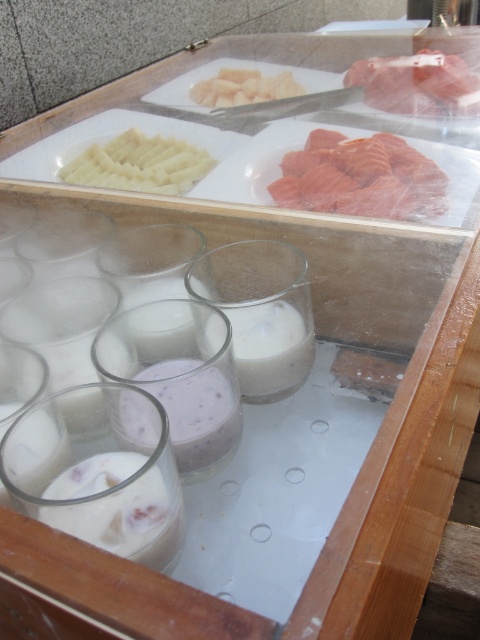
Question: Which object appears farthest from the camera in this image?

Choices:
 (A) pinkish-orange flesh at upper right
 (B) white creamy sliced potatoes at upper left
 (C) purple creamy smoothie at center

Answer: (B)

Question: Considering the relative positions of purple creamy smoothie at center and pinkish raw meat at upper right in the image provided, where is purple creamy smoothie at center located with respect to pinkish raw meat at upper right?

Choices:
 (A) left
 (B) right

Answer: (A)

Question: Which point is farther to the camera?

Choices:
 (A) (179, 156)
 (B) (298, 321)
 (C) (251, 70)
 (D) (170, 413)

Answer: (C)

Question: Considering the relative positions of pinkish-orange flesh at upper right and white creamy sliced potatoes at upper left in the image provided, where is pinkish-orange flesh at upper right located with respect to white creamy sliced potatoes at upper left?

Choices:
 (A) above
 (B) below

Answer: (B)

Question: Estimate the real-world distances between objects in this image. Which object is closer to the pinkish raw meat at upper right?

Choices:
 (A) pinkish-orange flesh at upper right
 (B) white creamy cubes at center
 (C) white creamy sliced potatoes at upper left
 (D) white creamy milk at center

Answer: (B)

Question: Where is pinkish-orange flesh at upper right located in relation to white creamy milk at center in the image?

Choices:
 (A) below
 (B) above

Answer: (B)